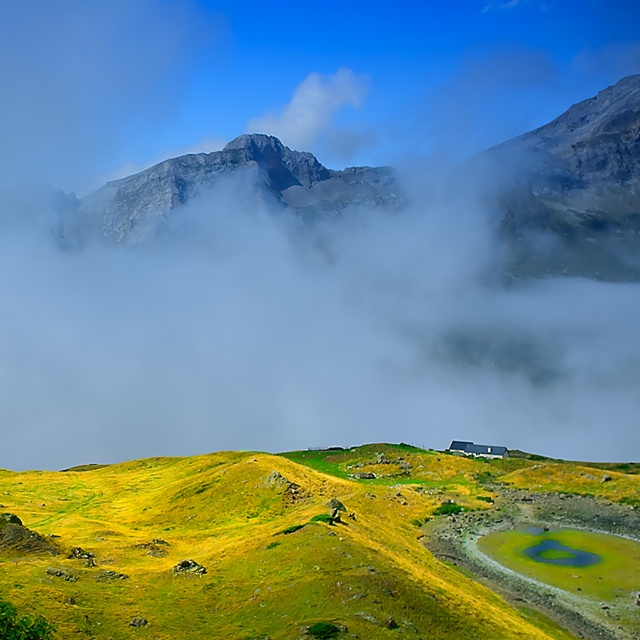
Question: In this image, where is white mist at upper center located relative to green grassy hillside at center?

Choices:
 (A) above
 (B) below

Answer: (A)

Question: Can you confirm if green grassy hillside at center is bigger than rugged granite mountain at upper center?

Choices:
 (A) no
 (B) yes

Answer: (A)

Question: Which point is farther to the camera?

Choices:
 (A) (268, 531)
 (B) (349, 102)
 (C) (257, 275)
 (D) (122, 208)

Answer: (B)

Question: Which point is closer to the camera?

Choices:
 (A) rugged granite mountain at upper center
 (B) white mist at upper center
 (C) green grassy hillside at center
 (D) white fluffy cloud at upper center

Answer: (C)

Question: Is green grassy hillside at center to the left of rugged granite mountain at upper center from the viewer's perspective?

Choices:
 (A) yes
 (B) no

Answer: (B)

Question: Estimate the real-world distances between objects in this image. Which object is closer to the white fluffy cloud at upper center?

Choices:
 (A) rugged granite mountain at upper center
 (B) green grassy hillside at center
 (C) white mist at upper center

Answer: (C)